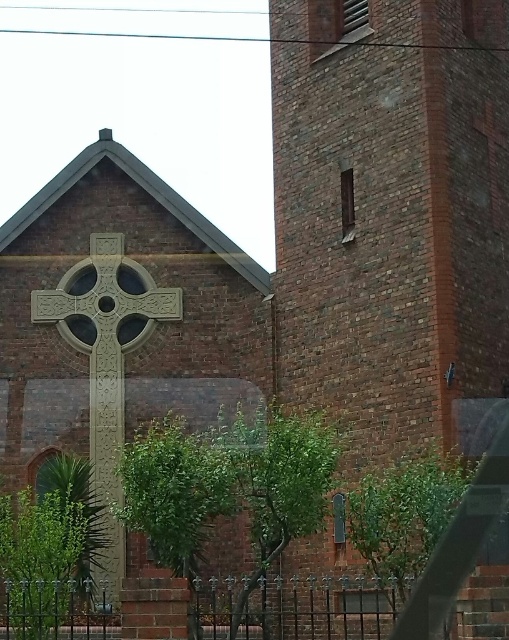
Question: Where is brick tower at center located in relation to carved stone cross at center in the image?

Choices:
 (A) left
 (B) right

Answer: (B)

Question: Observing the image, what is the correct spatial positioning of brick tower at center in reference to carved stone cross at center?

Choices:
 (A) right
 (B) left

Answer: (A)

Question: Among these points, which one is farthest from the camera?

Choices:
 (A) (115, 461)
 (B) (466, 125)

Answer: (A)

Question: Which of the following is the closest to the observer?

Choices:
 (A) brick tower at center
 (B) carved stone cross at center

Answer: (A)

Question: Is brick tower at center above carved stone cross at center?

Choices:
 (A) no
 (B) yes

Answer: (B)